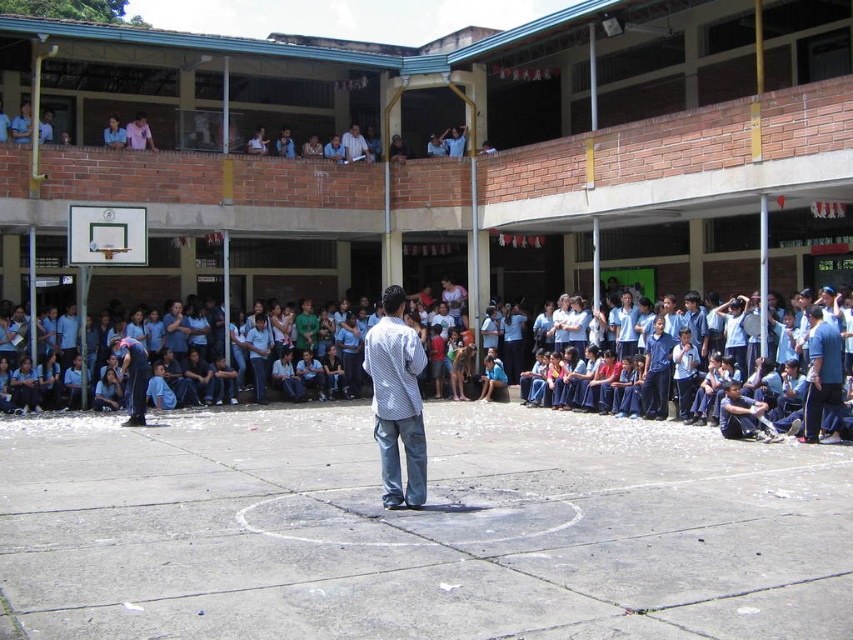
You are standing at the back of the courtyard and want to take a photo of the white checkered shirt at center. Is the distance within the camera range of 30 feet?

The white checkered shirt at center is 31.67 feet away from the camera, which is beyond the camera range of 30 feet. Therefore, the distance is not within the camera range.

You are a student in the courtyard and want to pass a note to the teacher wearing the white checkered shirt at center without the blue uniform at right noticing. Which direction should you pass the note?

The white checkered shirt at center is in front of the blue uniform at right, so passing the note forward towards the white checkered shirt at center would keep the blue uniform at right from noticing.

You are a photographer trying to capture a group photo of the blue uniform at center and the white checkered shirt at center. If you want to ensure both subjects are fully visible in the frame, which subject should you position closer to the camera?

The blue uniform at center should be positioned closer to the camera because it might be wider than the white checkered shirt at center, ensuring both fit within the frame.